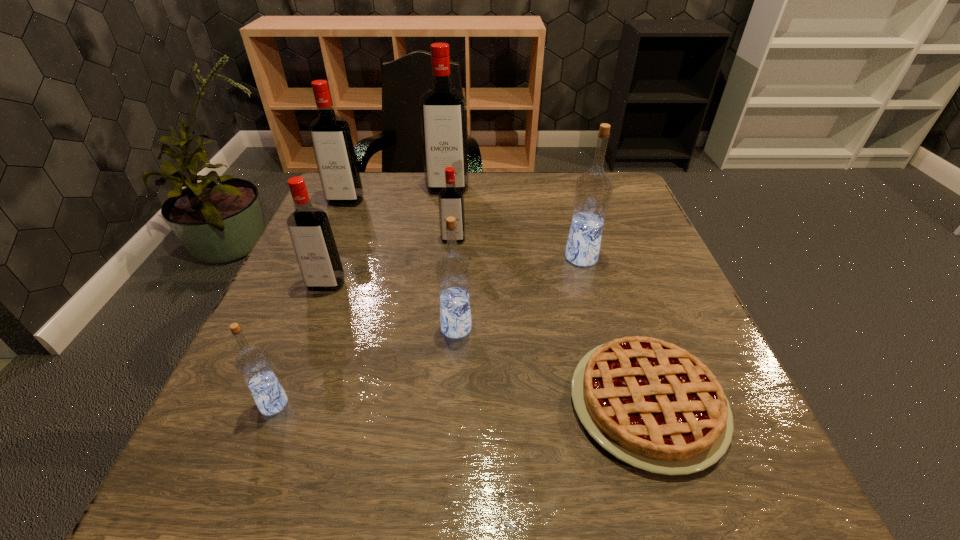
This screenshot has width=960, height=540. I want to click on free location located on the front and back of the smallest red vodka, so click(448, 303).

Image resolution: width=960 pixels, height=540 pixels. I want to click on blank space located 0.320m on the back of the nearest blue vodka, so pyautogui.click(x=329, y=266).

Identify the location of free region located 0.100m on the left of the shortest object. The height and width of the screenshot is (540, 960). (508, 403).

The width and height of the screenshot is (960, 540). I want to click on object that is positioned at the near edge, so click(x=651, y=404).

This screenshot has width=960, height=540. Identify the location of vodka located in the right edge section of the desktop. (593, 190).

This screenshot has height=540, width=960. In order to click on pie that is at the right edge in this screenshot , I will do `click(651, 404)`.

Locate an element on the screen. The image size is (960, 540). object that is at the far left corner is located at coordinates (330, 134).

Locate an element on the screen. object that is at the near right corner is located at coordinates (651, 404).

This screenshot has height=540, width=960. What are the coordinates of `free space at the far edge of the desktop` in the screenshot? It's located at (536, 217).

Where is `vacant space at the near edge of the desktop`? vacant space at the near edge of the desktop is located at coordinates (591, 507).